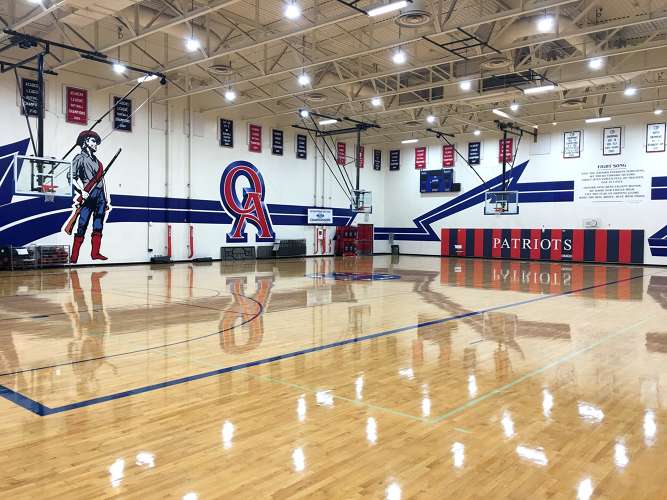
At what (x,y) coordinates should I click in order to perform the action: click on blue line on floor. Please return your answer as a coordinate pair (x, y). This screenshot has height=500, width=667. Looking at the image, I should click on point(257,362).